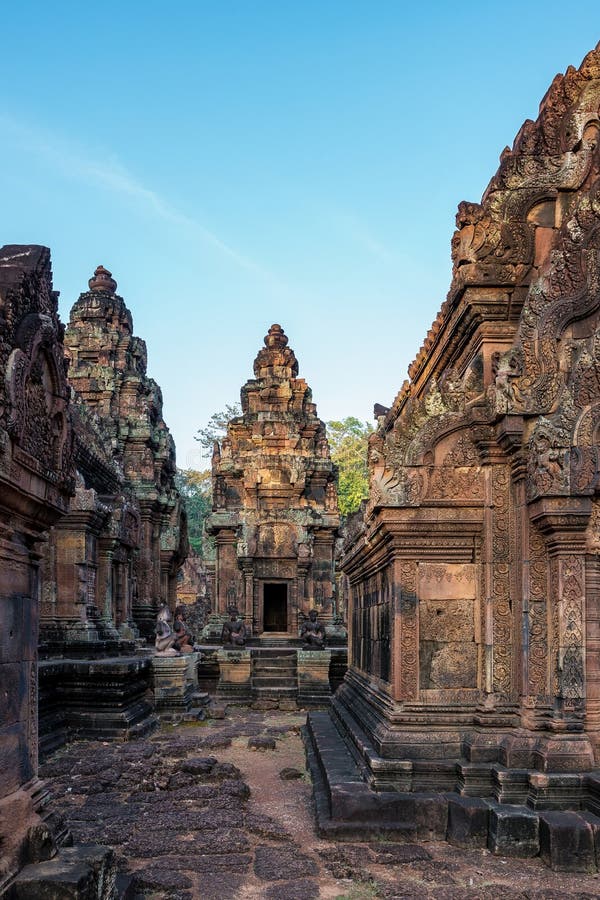
You are a GUI agent. You are given a task and a screenshot of the screen. Output one action in this format:
    pyautogui.click(x=<x>, y=<y>)
    Task: Click on the shelf
    
    Given the screenshot: What is the action you would take?
    pyautogui.click(x=277, y=667)